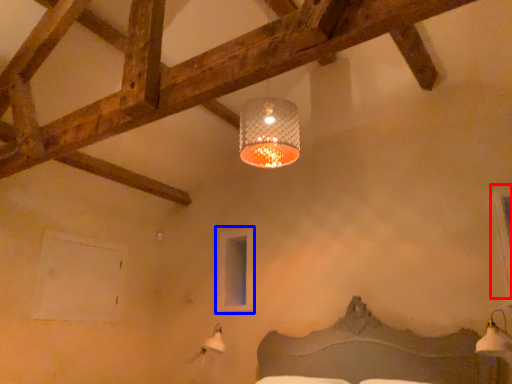
Question: Which object appears farthest to the camera in this image, window (highlighted by a red box) or window (highlighted by a blue box)?

Choices:
 (A) window
 (B) window

Answer: (B)